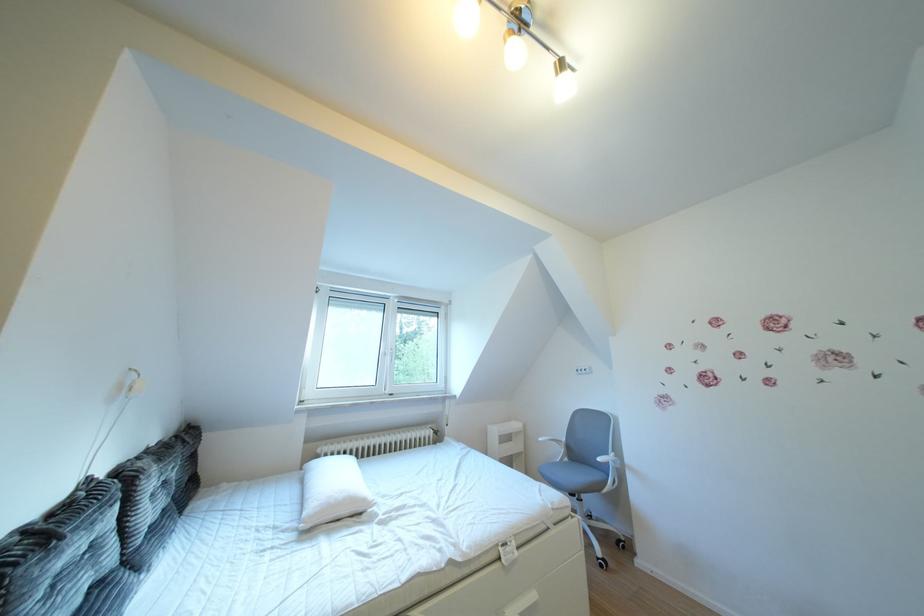
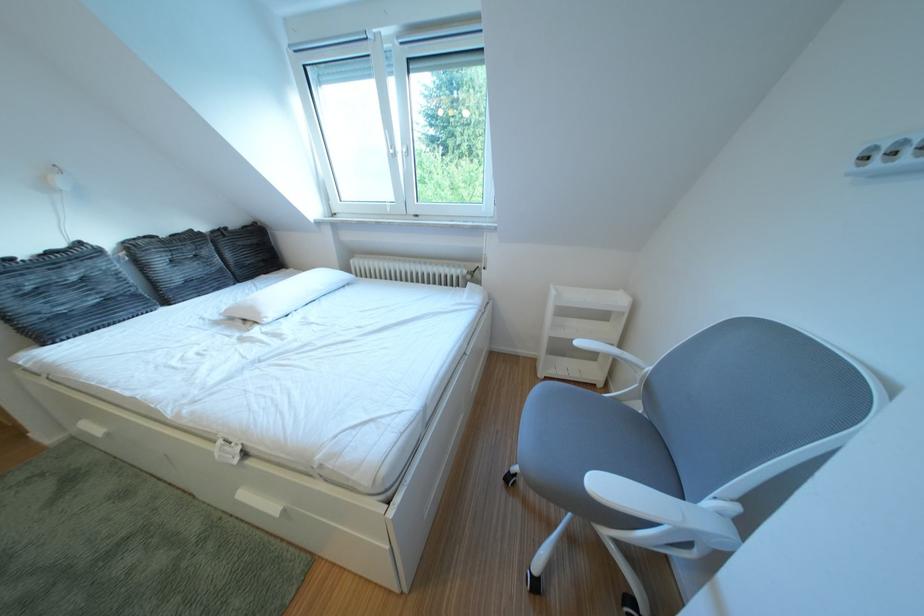
Find the pixel in the second image that matches pixel 378 505 in the first image.

(273, 318)